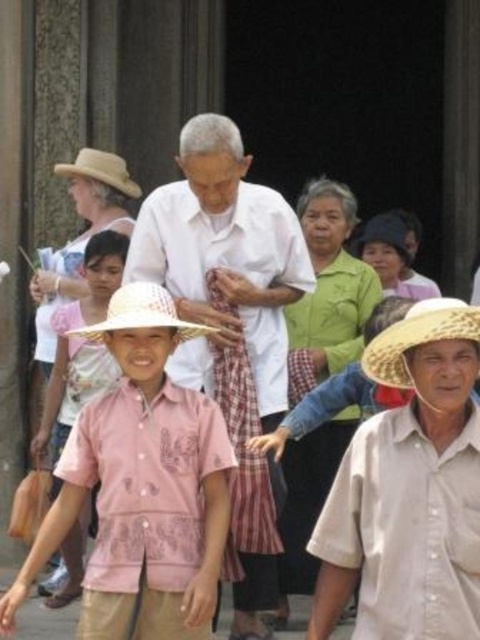
Question: Which is farther from the strawmaterial/texturehat at lower right?

Choices:
 (A) matte straw hat at left
 (B) white straw hat at center
 (C) white matte shirt at center
 (D) beige felt cowboy hat at upper left

Answer: (D)

Question: Does matte straw hat at left come in front of white straw hat at center?

Choices:
 (A) yes
 (B) no

Answer: (B)

Question: Is white matte shirt at center to the left of beige felt cowboy hat at upper left from the viewer's perspective?

Choices:
 (A) yes
 (B) no

Answer: (B)

Question: Can you confirm if white matte shirt at center is thinner than white straw hat at center?

Choices:
 (A) no
 (B) yes

Answer: (A)

Question: Among these points, which one is nearest to the camera?

Choices:
 (A) pyautogui.click(x=396, y=326)
 (B) pyautogui.click(x=123, y=177)
 (C) pyautogui.click(x=136, y=300)

Answer: (A)

Question: Which of these objects is positioned farthest from the matte straw hat at left?

Choices:
 (A) white straw hat at center
 (B) beige felt cowboy hat at upper left
 (C) strawmaterial/texturehat at lower right

Answer: (C)